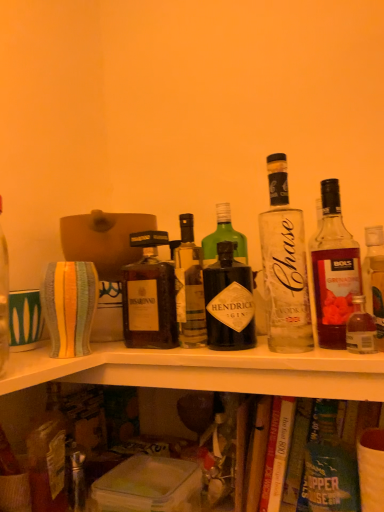
Measure the distance between matte brown liquor bottle at center, the 1th bottle positioned from the left, and camera.

matte brown liquor bottle at center, the 1th bottle positioned from the left, and camera are 31.59 inches apart from each other.

This screenshot has width=384, height=512. What do you see at coordinates (189, 288) in the screenshot? I see `dark brown glass bottle at center, which is the 2th bottle in left-to-right order` at bounding box center [189, 288].

The image size is (384, 512). Describe the element at coordinates (277, 453) in the screenshot. I see `hardcover book at lower center` at that location.

Locate an element on the screen. Image resolution: width=384 pixels, height=512 pixels. matte brown liquor bottle at center, arranged as the sixth bottle when viewed from the right is located at coordinates pos(149,296).

Is translucent glass bottle at upper right, positioned as the fifth bottle in left-to-right order, next to green glass bottle at center, acting as the third bottle starting from the right, and touching it?

No, translucent glass bottle at upper right, positioned as the fifth bottle in left-to-right order, is not touching green glass bottle at center, acting as the third bottle starting from the right.

From a real-world perspective, between translucent glass bottle at upper right, positioned as the fifth bottle in left-to-right order, and green glass bottle at center, the fourth bottle when ordered from left to right, who is vertically higher?

translucent glass bottle at upper right, positioned as the fifth bottle in left-to-right order.

Would you say translucent glass bottle at upper right, marked as the 2th bottle in a right-to-left arrangement, is inside or outside green glass bottle at center, the fourth bottle when ordered from left to right?

translucent glass bottle at upper right, marked as the 2th bottle in a right-to-left arrangement, is not enclosed by green glass bottle at center, the fourth bottle when ordered from left to right.

Which is more to the right, translucent glass bottle at upper right, positioned as the fifth bottle in left-to-right order, or green glass bottle at center, acting as the third bottle starting from the right?

Positioned to the right is translucent glass bottle at upper right, positioned as the fifth bottle in left-to-right order.

Can you confirm if dark brown glass bottle at center, which is the 2th bottle in left-to-right order, is taller than green glass bottle at center, acting as the third bottle starting from the right?

Yes.

Is dark brown glass bottle at center, the fifth bottle in the right-to-left sequence, touching green glass bottle at center, acting as the third bottle starting from the right?

No, dark brown glass bottle at center, the fifth bottle in the right-to-left sequence, is not making contact with green glass bottle at center, acting as the third bottle starting from the right.

Which object is further away from the camera taking this photo, dark brown glass bottle at center, the fifth bottle in the right-to-left sequence, or green glass bottle at center, acting as the third bottle starting from the right?

dark brown glass bottle at center, the fifth bottle in the right-to-left sequence, is further from the camera.

Considering the positions of objects dark brown glass bottle at center, the fifth bottle in the right-to-left sequence, and green glass bottle at center, acting as the third bottle starting from the right, in the image provided, who is more to the right, dark brown glass bottle at center, the fifth bottle in the right-to-left sequence, or green glass bottle at center, acting as the third bottle starting from the right,?

green glass bottle at center, acting as the third bottle starting from the right, is more to the right.

Is dark brown glass bottle at center, the fifth bottle in the right-to-left sequence, spatially inside matte brown liquor bottle at center, the 1th bottle positioned from the left, or outside of it?

dark brown glass bottle at center, the fifth bottle in the right-to-left sequence, is not inside matte brown liquor bottle at center, the 1th bottle positioned from the left, it's outside.

There is a dark brown glass bottle at center, which is the 2th bottle in left-to-right order. Identify the location of the 1st bottle below it (from the image's perspective). (149, 296).

In the image, is dark brown glass bottle at center, which is the 2th bottle in left-to-right order, on the left side or the right side of matte brown liquor bottle at center, the 1th bottle positioned from the left?

Based on their positions, dark brown glass bottle at center, which is the 2th bottle in left-to-right order, is located to the right of matte brown liquor bottle at center, the 1th bottle positioned from the left.

Are hardcover book at lower center and clear glass bottle at center, which appears as the 4th bottle when viewed from the right, far apart?

No, hardcover book at lower center is not far away from clear glass bottle at center, which appears as the 4th bottle when viewed from the right.

Relative to clear glass bottle at center, which appears as the 4th bottle when viewed from the right, is hardcover book at lower center in front or behind?

hardcover book at lower center is positioned farther from the viewer than clear glass bottle at center, which appears as the 4th bottle when viewed from the right.

Is hardcover book at lower center located outside clear glass bottle at center, the third bottle in the left-to-right sequence?

That's correct, hardcover book at lower center is outside of clear glass bottle at center, the third bottle in the left-to-right sequence.

Is clear glass bottle at center, the third bottle in the left-to-right sequence, at the back of hardcover book at lower center?

hardcover book at lower center is not turned away from clear glass bottle at center, the third bottle in the left-to-right sequence.

Is translucent glass bottle at upper right, marked as the 2th bottle in a right-to-left arrangement, taller than dark brown glass bottle at center, the fifth bottle in the right-to-left sequence?

Indeed, translucent glass bottle at upper right, marked as the 2th bottle in a right-to-left arrangement, has a greater height compared to dark brown glass bottle at center, the fifth bottle in the right-to-left sequence.

From a real-world perspective, is translucent glass bottle at upper right, marked as the 2th bottle in a right-to-left arrangement, above or below dark brown glass bottle at center, the fifth bottle in the right-to-left sequence?

translucent glass bottle at upper right, marked as the 2th bottle in a right-to-left arrangement, is situated higher than dark brown glass bottle at center, the fifth bottle in the right-to-left sequence, in the real world.

From the image's perspective, between translucent glass bottle at upper right, marked as the 2th bottle in a right-to-left arrangement, and dark brown glass bottle at center, the fifth bottle in the right-to-left sequence, which one is located above?

translucent glass bottle at upper right, marked as the 2th bottle in a right-to-left arrangement.

Is translucent glass bottle at upper right, positioned as the fifth bottle in left-to-right order, turned away from dark brown glass bottle at center, which is the 2th bottle in left-to-right order?

translucent glass bottle at upper right, positioned as the fifth bottle in left-to-right order, does not have its back to dark brown glass bottle at center, which is the 2th bottle in left-to-right order.

From a real-world perspective, which is physically above, clear glass bottle at center, the third bottle in the left-to-right sequence, or translucent glass bottle at upper right, marked as the 2th bottle in a right-to-left arrangement?

From a 3D spatial view, clear glass bottle at center, the third bottle in the left-to-right sequence, is above.

Considering the relative sizes of clear glass bottle at center, which appears as the 4th bottle when viewed from the right, and translucent glass bottle at upper right, positioned as the fifth bottle in left-to-right order, in the image provided, is clear glass bottle at center, which appears as the 4th bottle when viewed from the right, wider than translucent glass bottle at upper right, positioned as the fifth bottle in left-to-right order,?

Yes, clear glass bottle at center, which appears as the 4th bottle when viewed from the right, is wider than translucent glass bottle at upper right, positioned as the fifth bottle in left-to-right order.

From the image's perspective, which one is positioned lower, clear glass bottle at center, which appears as the 4th bottle when viewed from the right, or translucent glass bottle at upper right, positioned as the fifth bottle in left-to-right order?

From the image's view, translucent glass bottle at upper right, positioned as the fifth bottle in left-to-right order, is below.

Does clear glass bottle at center, the third bottle in the left-to-right sequence, lie in front of translucent glass bottle at upper right, marked as the 2th bottle in a right-to-left arrangement?

Yes, it is in front of translucent glass bottle at upper right, marked as the 2th bottle in a right-to-left arrangement.

Is green glass bottle at center, the fourth bottle when ordered from left to right, closer to camera compared to dark brown glass bottle at center, the fifth bottle in the right-to-left sequence?

Yes, the depth of green glass bottle at center, the fourth bottle when ordered from left to right, is less than that of dark brown glass bottle at center, the fifth bottle in the right-to-left sequence.

Is dark brown glass bottle at center, the fifth bottle in the right-to-left sequence, inside green glass bottle at center, the fourth bottle when ordered from left to right?

No, dark brown glass bottle at center, the fifth bottle in the right-to-left sequence, is not surrounded by green glass bottle at center, the fourth bottle when ordered from left to right.

Based on the photo, from a real-world perspective, is green glass bottle at center, the fourth bottle when ordered from left to right, above or below dark brown glass bottle at center, the fifth bottle in the right-to-left sequence?

Clearly, from a real-world perspective, green glass bottle at center, the fourth bottle when ordered from left to right, is below dark brown glass bottle at center, the fifth bottle in the right-to-left sequence.

This screenshot has width=384, height=512. There is a translucent glass bottle at upper right, marked as the 2th bottle in a right-to-left arrangement. Identify the location of the 4th bottle below it (from the image's perspective). (329, 466).

From the image's perspective, count 3rd bottles upward from the green glass bottle at center, the fourth bottle when ordered from left to right, and point to it. Please provide its 2D coordinates.

[(189, 288)]

Estimate the real-world distances between objects in this image. Which object is further from translucent glass bottle at upper right, the sixth bottle from the left, dark brown glass bottle at center, which is the 2th bottle in left-to-right order, or hardcover book at lower center?

dark brown glass bottle at center, which is the 2th bottle in left-to-right order.

When comparing their distances from translucent glass bottle at upper right, positioned as the fifth bottle in left-to-right order, does dark brown glass bottle at center, the fifth bottle in the right-to-left sequence, or green glass bottle at center, acting as the third bottle starting from the right, seem further?

dark brown glass bottle at center, the fifth bottle in the right-to-left sequence, is positioned further to the anchor translucent glass bottle at upper right, positioned as the fifth bottle in left-to-right order.

Estimate the real-world distances between objects in this image. Which object is further from hardcover book at lower center, clear glass bottle at center, which appears as the 4th bottle when viewed from the right, or translucent glass bottle at upper right, marked as the 2th bottle in a right-to-left arrangement?

Among the two, translucent glass bottle at upper right, marked as the 2th bottle in a right-to-left arrangement, is located further to hardcover book at lower center.

Consider the image. Considering their positions, is green glass bottle at center, acting as the third bottle starting from the right, positioned closer to translucent glass bottle at upper right, positioned as the fifth bottle in left-to-right order, than dark brown glass bottle at center, which is the 2th bottle in left-to-right order?

Among the two, green glass bottle at center, acting as the third bottle starting from the right, is located nearer to translucent glass bottle at upper right, positioned as the fifth bottle in left-to-right order.

Considering their positions, is dark brown glass bottle at center, the fifth bottle in the right-to-left sequence, positioned closer to matte brown liquor bottle at center, arranged as the sixth bottle when viewed from the right, than clear glass bottle at center, which appears as the 4th bottle when viewed from the right?

dark brown glass bottle at center, the fifth bottle in the right-to-left sequence, lies closer to matte brown liquor bottle at center, arranged as the sixth bottle when viewed from the right, than the other object.

Consider the image. Looking at the image, which one is located closer to dark brown glass bottle at center, the fifth bottle in the right-to-left sequence, hardcover book at lower center or green glass bottle at center, acting as the third bottle starting from the right?

hardcover book at lower center lies closer to dark brown glass bottle at center, the fifth bottle in the right-to-left sequence, than the other object.

Looking at this image, estimate the real-world distances between objects in this image. Which object is further from translucent glass bottle at upper right, the sixth bottle from the left, green glass bottle at center, acting as the third bottle starting from the right, or matte brown liquor bottle at center, arranged as the sixth bottle when viewed from the right?

matte brown liquor bottle at center, arranged as the sixth bottle when viewed from the right, is further to translucent glass bottle at upper right, the sixth bottle from the left.

When comparing their distances from green glass bottle at center, the fourth bottle when ordered from left to right, does hardcover book at lower center or translucent glass bottle at upper right, marked as the first bottle in a right-to-left arrangement, seem closer?

hardcover book at lower center lies closer to green glass bottle at center, the fourth bottle when ordered from left to right, than the other object.

You are a GUI agent. You are given a task and a screenshot of the screen. Output one action in this format:
    pyautogui.click(x=<x>, y=<y>)
    Task: Click on the book between clear glass bottle at center, which appears as the 4th bottle when viewed from the right, and green glass bottle at center, the fourth bottle when ordered from left to right, in the up-down direction
    This screenshot has width=384, height=512.
    Given the screenshot: What is the action you would take?
    pyautogui.click(x=277, y=453)

You are a GUI agent. You are given a task and a screenshot of the screen. Output one action in this format:
    pyautogui.click(x=<x>, y=<y>)
    Task: Click on the book between translucent glass bottle at upper right, marked as the first bottle in a right-to-left arrangement, and green glass bottle at center, acting as the third bottle starting from the right, in the up-down direction
    The width and height of the screenshot is (384, 512).
    Given the screenshot: What is the action you would take?
    pyautogui.click(x=277, y=453)

Where is `book that lies between translucent glass bottle at upper right, positioned as the fifth bottle in left-to-right order, and green glass bottle at center, the fourth bottle when ordered from left to right, from top to bottom`? The width and height of the screenshot is (384, 512). book that lies between translucent glass bottle at upper right, positioned as the fifth bottle in left-to-right order, and green glass bottle at center, the fourth bottle when ordered from left to right, from top to bottom is located at coordinates (277, 453).

Where is `book between matte brown liquor bottle at center, arranged as the sixth bottle when viewed from the right, and green glass bottle at center, the fourth bottle when ordered from left to right`? book between matte brown liquor bottle at center, arranged as the sixth bottle when viewed from the right, and green glass bottle at center, the fourth bottle when ordered from left to right is located at coordinates (277, 453).